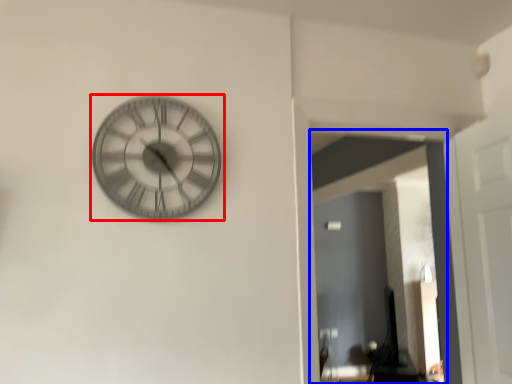
Question: Among these objects, which one is nearest to the camera, wall clock (highlighted by a red box) or glass door (highlighted by a blue box)?

Choices:
 (A) wall clock
 (B) glass door

Answer: (A)